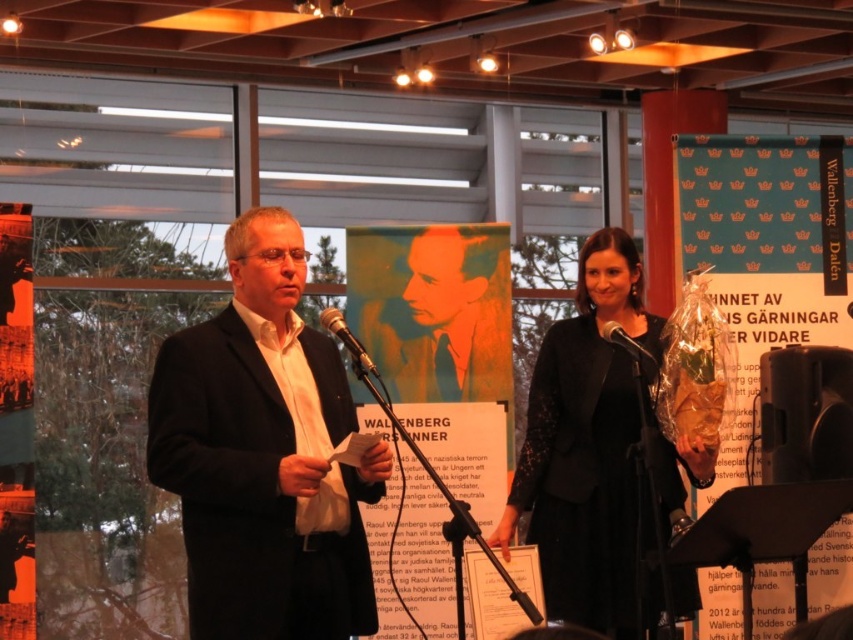
Which of these two, white paper at center or black plastic microphone at center, stands taller?

white paper at center is taller.

Which is above, white paper at center or black plastic microphone at center?

black plastic microphone at center

This screenshot has height=640, width=853. What are the coordinates of `white paper at center` in the screenshot? It's located at (408, 545).

Image resolution: width=853 pixels, height=640 pixels. I want to click on white paper at center, so click(408, 545).

Looking at this image, measure the distance between black lace dress at center and camera.

3.20 meters

Can you confirm if black lace dress at center is smaller than matte black poster at upper center?

No, black lace dress at center is not smaller than matte black poster at upper center.

The image size is (853, 640). I want to click on black lace dress at center, so click(x=595, y=451).

Can you confirm if black lace dress at center is smaller than black matte microphone at center?

No.

Can you confirm if black lace dress at center is shorter than black matte microphone at center?

In fact, black lace dress at center may be taller than black matte microphone at center.

Measure the distance between black lace dress at center and camera.

black lace dress at center is 10.50 feet from camera.

Locate an element on the screen. This screenshot has height=640, width=853. black lace dress at center is located at coordinates (595, 451).